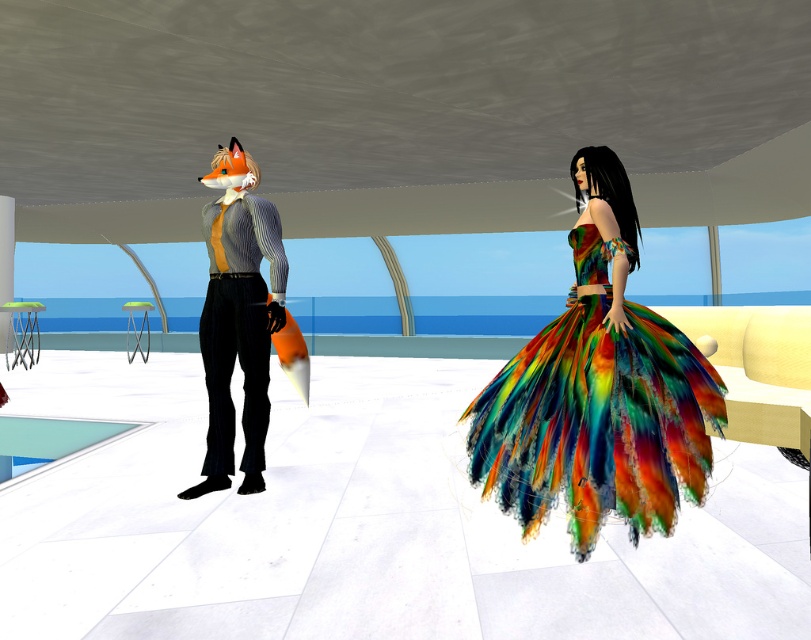
Question: Is rainbow feather dress at center wider than matte striped shirt at center?

Choices:
 (A) yes
 (B) no

Answer: (A)

Question: Does rainbow feather dress at center appear on the right side of matte striped shirt at center?

Choices:
 (A) no
 (B) yes

Answer: (B)

Question: Does rainbow feather dress at center have a greater width compared to matte striped shirt at center?

Choices:
 (A) yes
 (B) no

Answer: (A)

Question: Which point appears farthest from the camera in this image?

Choices:
 (A) (629, 497)
 (B) (269, 225)

Answer: (B)